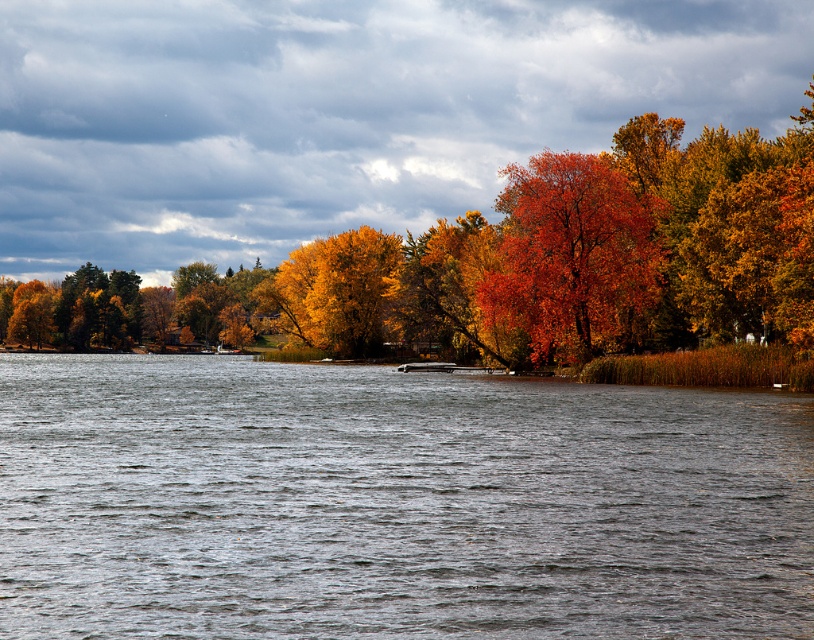
Question: Is gray water at center above vivid orange leaves at center?

Choices:
 (A) yes
 (B) no

Answer: (B)

Question: Among these objects, which one is farthest from the camera?

Choices:
 (A) gray water at center
 (B) vivid orange leaves at center

Answer: (B)

Question: Can you confirm if gray water at center is positioned above vivid orange leaves at center?

Choices:
 (A) no
 (B) yes

Answer: (A)

Question: Is gray water at center thinner than vivid orange leaves at center?

Choices:
 (A) no
 (B) yes

Answer: (A)

Question: Which point is closer to the camera?

Choices:
 (A) (537, 346)
 (B) (497, 461)

Answer: (B)